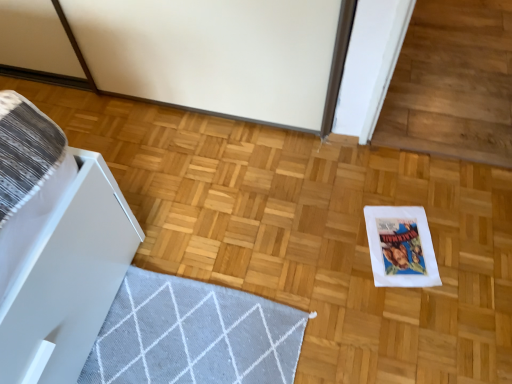
Find the location of `vacant area on the back side of matte white comic book at lower right`. vacant area on the back side of matte white comic book at lower right is located at coordinates (385, 189).